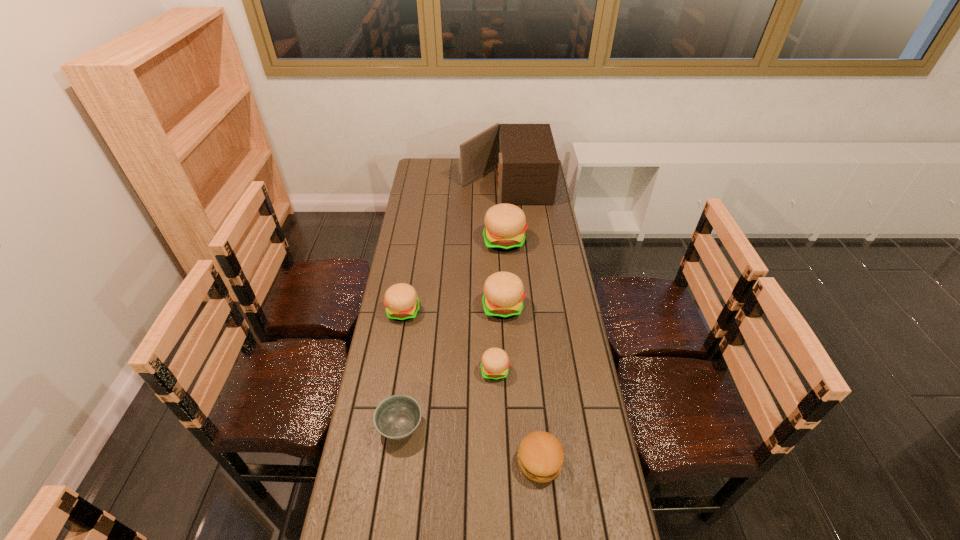
The width and height of the screenshot is (960, 540). What are the coordinates of `the farthest object` in the screenshot? It's located at (528, 165).

In order to click on microwave oven in this screenshot , I will do `click(528, 165)`.

At what (x,y) coordinates should I click in order to perform the action: click on the second tallest object. Please return your answer as a coordinate pair (x, y). This screenshot has width=960, height=540. Looking at the image, I should click on (505, 224).

Where is `the second farthest object`? The image size is (960, 540). the second farthest object is located at coordinates (505, 224).

Find the location of a particular element. The height and width of the screenshot is (540, 960). the fourth shortest hamburger is located at coordinates (504, 292).

This screenshot has height=540, width=960. What are the coordinates of `the fifth shortest object` in the screenshot? It's located at (504, 292).

Where is `the leftmost beige hamburger`? Image resolution: width=960 pixels, height=540 pixels. the leftmost beige hamburger is located at coordinates (402, 304).

Locate an element on the screen. the fourth shortest object is located at coordinates (402, 304).

You are a GUI agent. You are given a task and a screenshot of the screen. Output one action in this format:
    pyautogui.click(x=<x>, y=<y>)
    Task: Click on the nearest hamburger
    This screenshot has width=960, height=540.
    Given the screenshot: What is the action you would take?
    pyautogui.click(x=540, y=456)

In order to click on the fifth farthest object in this screenshot , I will do `click(495, 362)`.